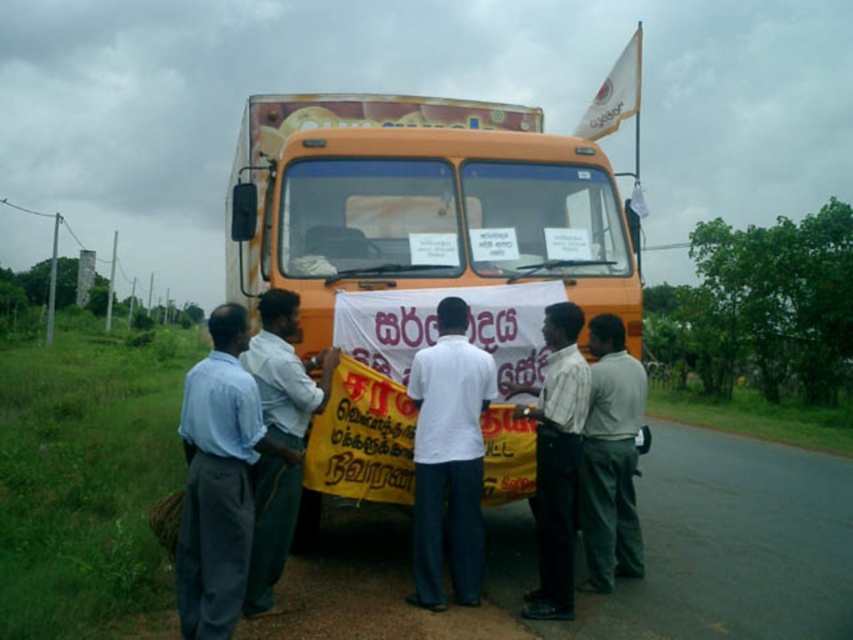
You are a photographer standing in front of the large orange truck. You notice two people in the scene wearing a light blue shirt at left and dark gray pants at right. Which clothing item is shorter in height?

The light blue shirt at left has a lesser height compared to dark gray pants at right, so the light blue shirt at left is shorter in height.

You are a photographer standing near the large orange truck. You notice a person wearing a light blue shirt at left and another wearing dark gray pants at right. If you want to take a photo that includes both individuals, which person should you move closer to the camera to ensure both are visible?

The light blue shirt at left is in front of dark gray pants at right. To ensure both are visible in the photo, you should move the person with dark gray pants at right closer to the camera so they are not blocked by the light blue shirt at left.

Looking at this image, you are a photographer standing 10 feet away from the truck. You want to take a photo of both the light blue shirt at left and the light blue shirt at center in the same frame. Can you fit both in your camera view without moving closer or further away?

The light blue shirt at left is 14.98 inches away from the light blue shirt at center. Since 14.98 inches is less than 10 feet, the photographer can fit both in the camera view without moving closer or further away.